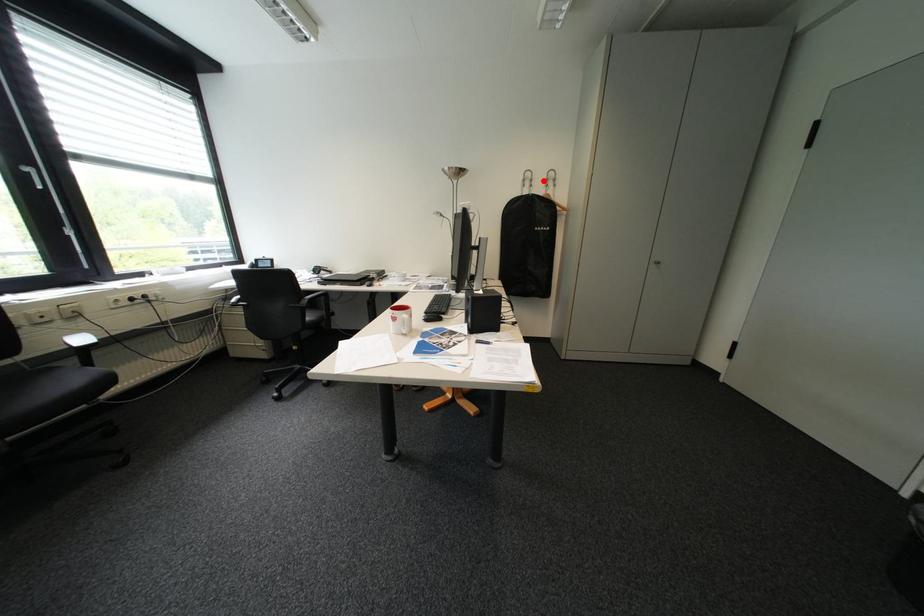
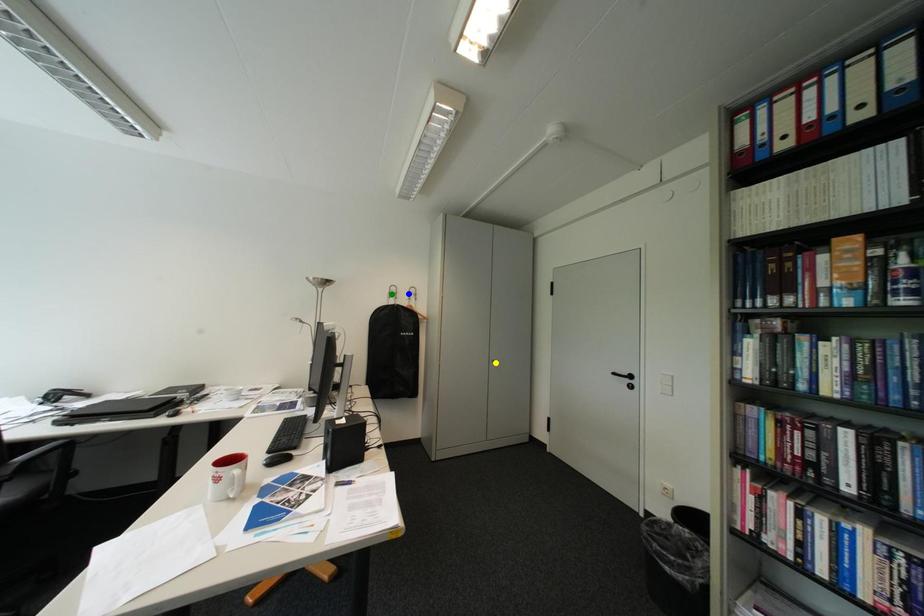
Question: I am providing you with two images of the same scene from different viewpoints. A red point is marked on the first image. You are given multiple points on the second image. Which mark in image 2 goes with the point in image 1?

Choices:
 (A) green point
 (B) blue point
 (C) yellow point

Answer: (B)